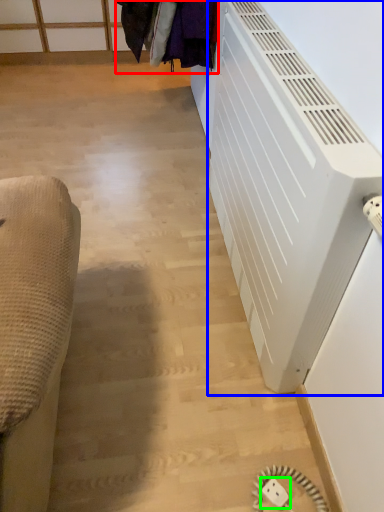
Question: Which object is positioned closest to laundry (highlighted by a red box)? Select from air conditioning (highlighted by a blue box) and electric outlet (highlighted by a green box).

Choices:
 (A) air conditioning
 (B) electric outlet

Answer: (A)